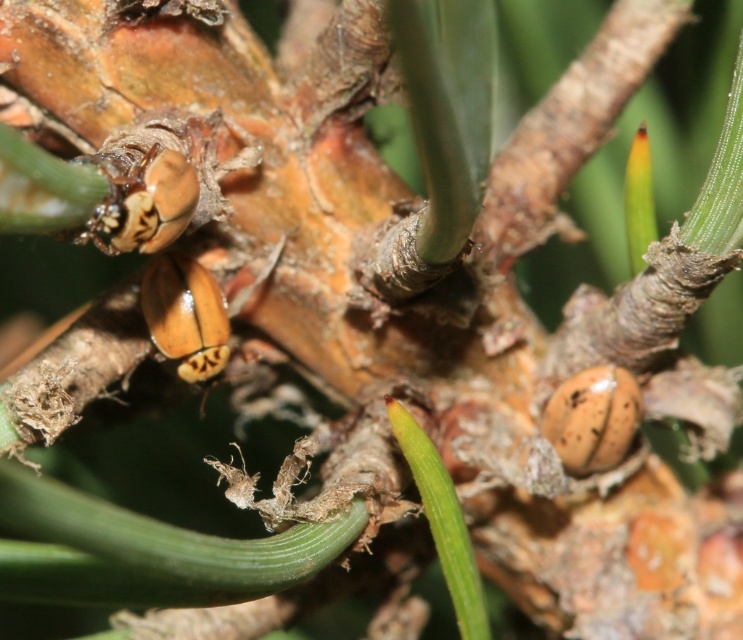
Question: Is brown matte beetle at center behind yellow-orange shell beetle at center?

Choices:
 (A) no
 (B) yes

Answer: (A)

Question: Considering the real-world distances, which object is farthest from the brown matte beetle at center?

Choices:
 (A) brown spotted shell at lower right
 (B) yellow-orange shell beetle at center

Answer: (A)

Question: Is brown matte beetle at center wider than brown spotted shell at lower right?

Choices:
 (A) no
 (B) yes

Answer: (A)

Question: Which of the following is the farthest from the observer?

Choices:
 (A) (111, 232)
 (B) (541, 424)

Answer: (B)

Question: Considering the real-world distances, which object is closest to the brown matte beetle at center?

Choices:
 (A) yellow-orange shell beetle at center
 (B) brown spotted shell at lower right

Answer: (A)

Question: Does brown matte beetle at center come behind yellow-orange shell beetle at center?

Choices:
 (A) no
 (B) yes

Answer: (A)